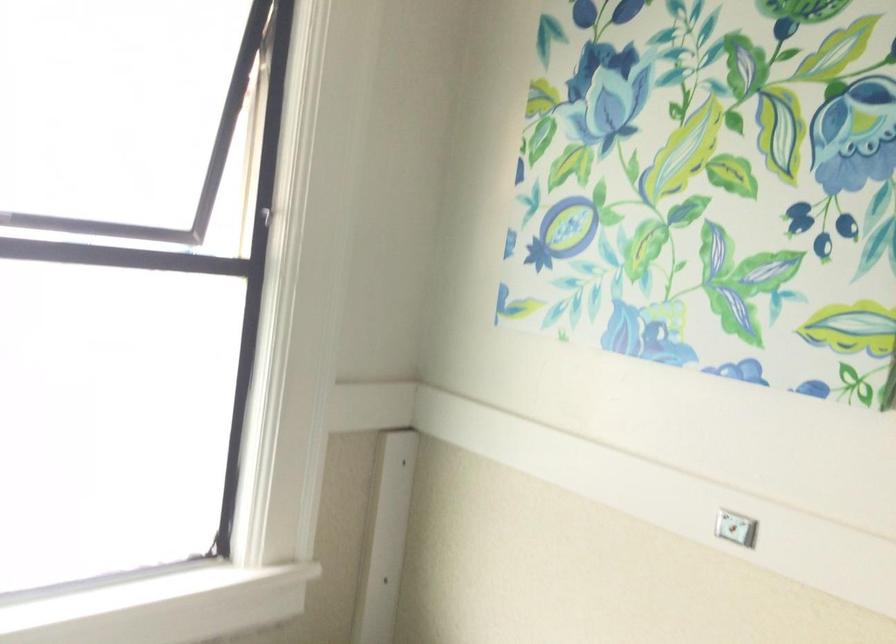
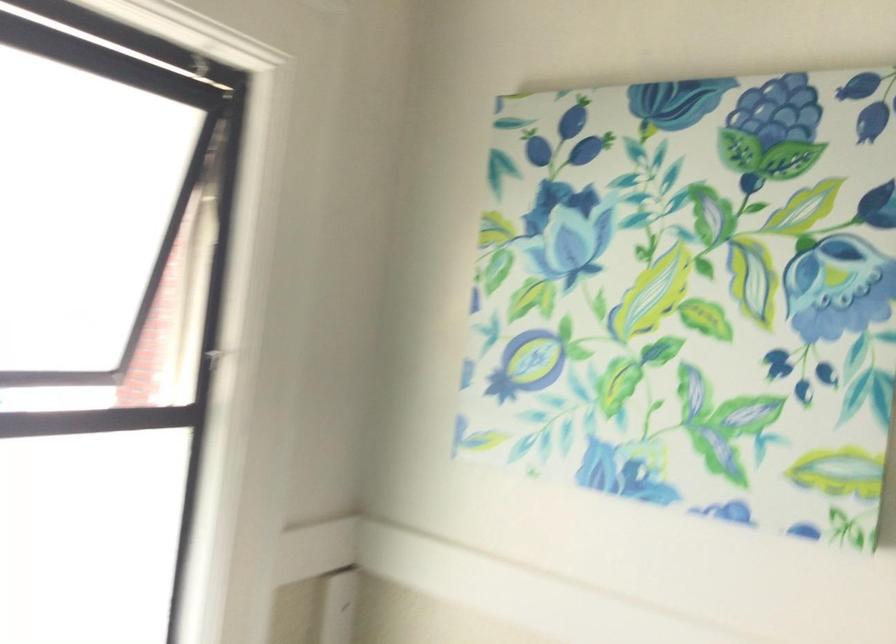
Question: The camera is either moving clockwise (left) or counter-clockwise (right) around the object. The first image is from the beginning of the video and the second image is from the end. Is the camera moving left or right when shooting the video?

Choices:
 (A) Left
 (B) Right

Answer: (A)